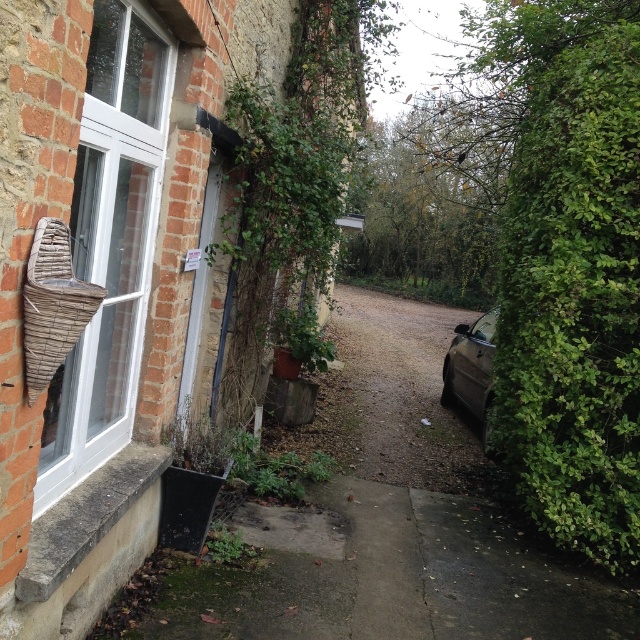
Question: Considering the real-world distances, which object is closest to the brown gravel driveway at center?

Choices:
 (A) metallic gray car at right
 (B) green matte plant at center

Answer: (B)

Question: Among these objects, which one is nearest to the camera?

Choices:
 (A) green leafy hedge at right
 (B) white plastic window at left

Answer: (B)

Question: Is metallic gray car at right wider than green matte plant at center?

Choices:
 (A) yes
 (B) no

Answer: (B)

Question: Does white plastic window at left lie behind green leafy plant at center?

Choices:
 (A) no
 (B) yes

Answer: (A)

Question: Considering the real-world distances, which object is closest to the metallic gray car at right?

Choices:
 (A) green leafy plant at center
 (B) green matte plant at center
 (C) brown gravel driveway at center

Answer: (B)

Question: In this image, where is green leafy hedge at right located relative to white plastic window at left?

Choices:
 (A) right
 (B) left

Answer: (A)